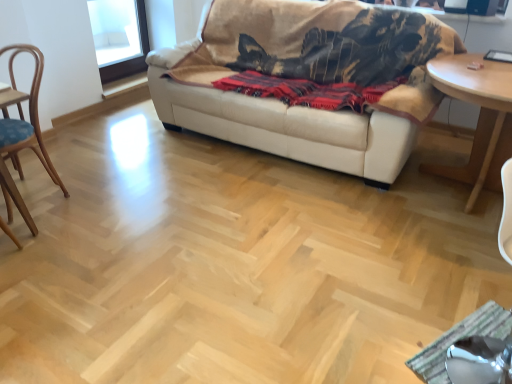
At what (x,y) coordinates should I click in order to perform the action: click on vacant area that is in front of beige leather couch at upper center. Please return your answer as a coordinate pair (x, y). The height and width of the screenshot is (384, 512). Looking at the image, I should click on (237, 244).